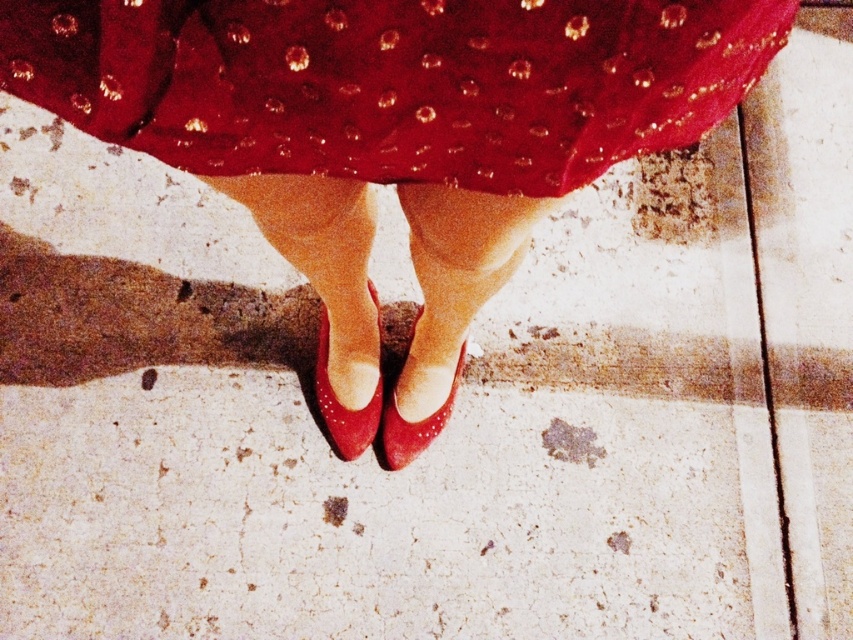
Does shiny patent leather shoes at center have a greater width compared to shiny red heels at center?

Yes.

Between shiny patent leather shoes at center and shiny red heels at center, which one has less height?

shiny red heels at center

In order to click on shiny patent leather shoes at center in this screenshot , I will do `click(392, 124)`.

Between shiny leather sandal at center and shiny red heels at center, which one has less height?

shiny red heels at center

Between point (358, 417) and point (445, 420), which one is positioned behind?

The point (445, 420) is more distant.

What are the coordinates of `shiny leather sandal at center` in the screenshot? It's located at (341, 404).

The image size is (853, 640). Identify the location of shiny leather sandal at center. (341, 404).

Who is more forward, [396,84] or [368,435]?

Point [396,84] is in front.

Can you confirm if shiny patent leather shoes at center is positioned below shiny leather sandal at center?

Actually, shiny patent leather shoes at center is above shiny leather sandal at center.

Image resolution: width=853 pixels, height=640 pixels. Describe the element at coordinates (392, 124) in the screenshot. I see `shiny patent leather shoes at center` at that location.

In order to click on shiny patent leather shoes at center in this screenshot , I will do `click(392, 124)`.